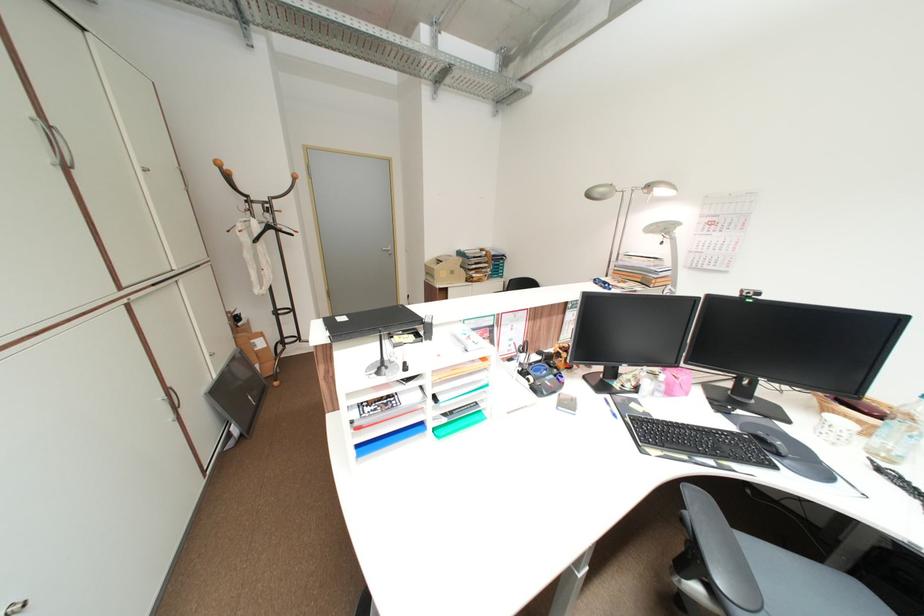
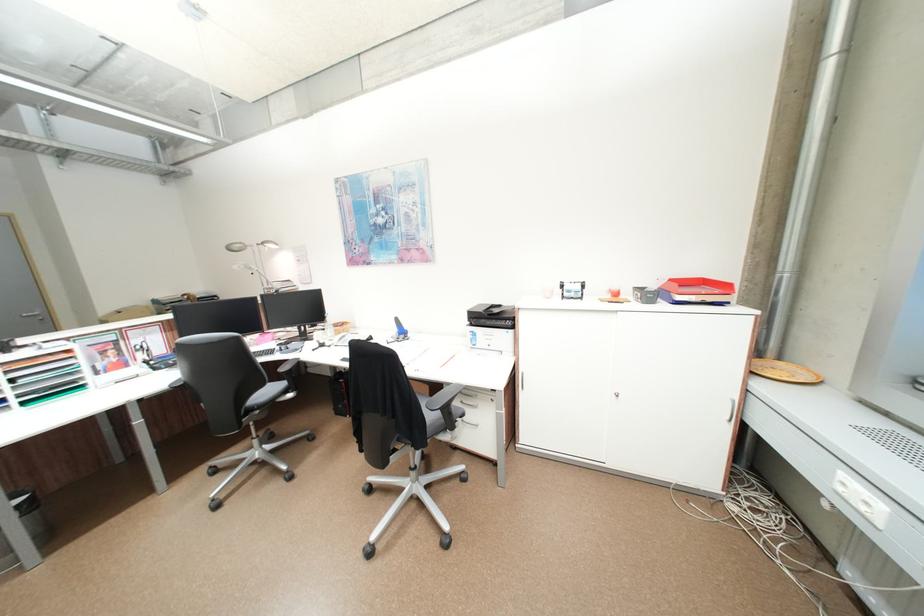
The point at (670, 192) is marked in the first image. Where is the corresponding point in the second image?

(281, 246)